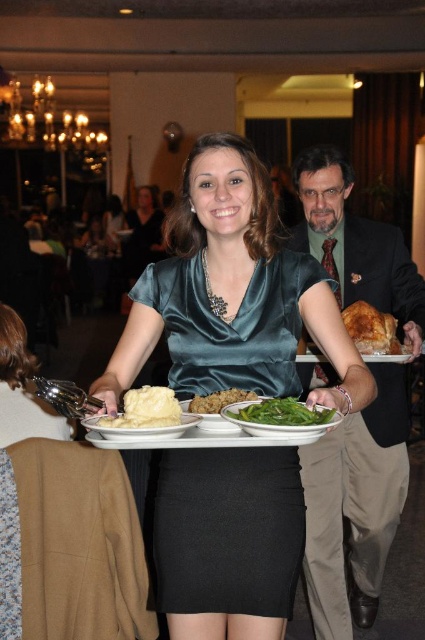
You are standing at the point with coordinates closest to the woman holding the tray. Which of the two points, point [130,419] or point [189,417], is closer to you?

Point [130,419] is in front of point [189,417], so it is closer to you.

You are a guest at this event and want to place a napkin on the table. The napkin is the same size as the brown crumbly bread at center. Will the white matte plate at center block the napkin from being fully visible if placed directly behind it?

The white matte plate at center is much taller than the brown crumbly bread at center. Therefore, placing the napkin the same size as the brown crumbly bread at center directly behind the plate would result in the plate blocking part of the napkin from view.